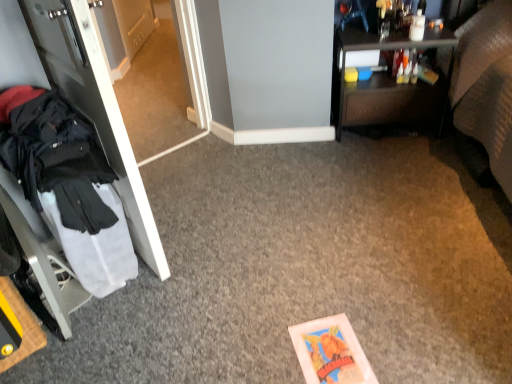
Locate an element on the screen. free space to the right of white glossy door at left is located at coordinates (224, 222).